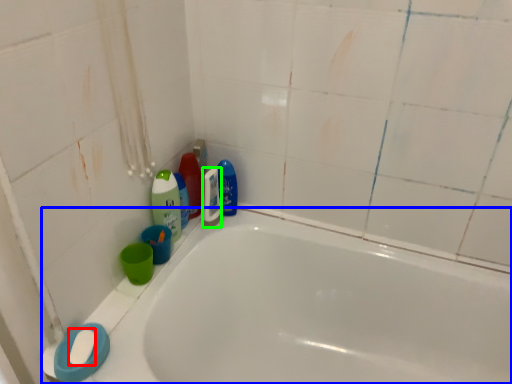
Question: Considering the real-world distances, which object is farthest from soap (highlighted by a red box)? bathtub (highlighted by a blue box) or mouthwash (highlighted by a green box)?

Choices:
 (A) bathtub
 (B) mouthwash

Answer: (A)